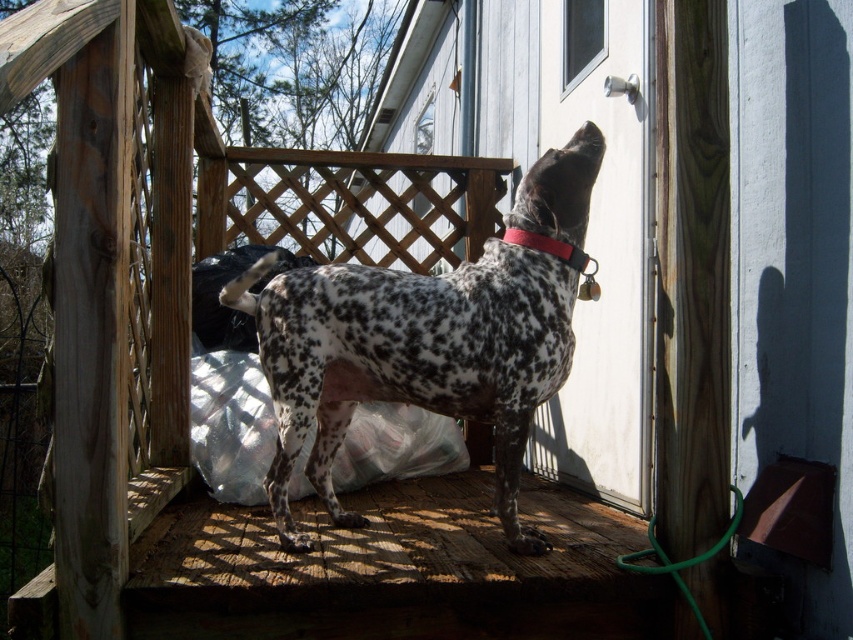
Question: Is spotted fur dog at center to the right of red leather collar at upper center from the viewer's perspective?

Choices:
 (A) no
 (B) yes

Answer: (A)

Question: Based on their relative distances, which object is farther from the white glossy screen door at upper center?

Choices:
 (A) red leather collar at upper center
 (B) spotted fur dog at center

Answer: (B)

Question: Which object is positioned farthest from the red leather collar at upper center?

Choices:
 (A) white glossy screen door at upper center
 (B) spotted fur dog at center

Answer: (A)

Question: Estimate the real-world distances between objects in this image. Which object is farther from the spotted fur dog at center?

Choices:
 (A) white glossy screen door at upper center
 (B) red leather collar at upper center

Answer: (A)

Question: Where is spotted fur dog at center located in relation to red leather collar at upper center in the image?

Choices:
 (A) above
 (B) below

Answer: (B)

Question: Can you confirm if spotted fur dog at center is smaller than white glossy screen door at upper center?

Choices:
 (A) no
 (B) yes

Answer: (B)